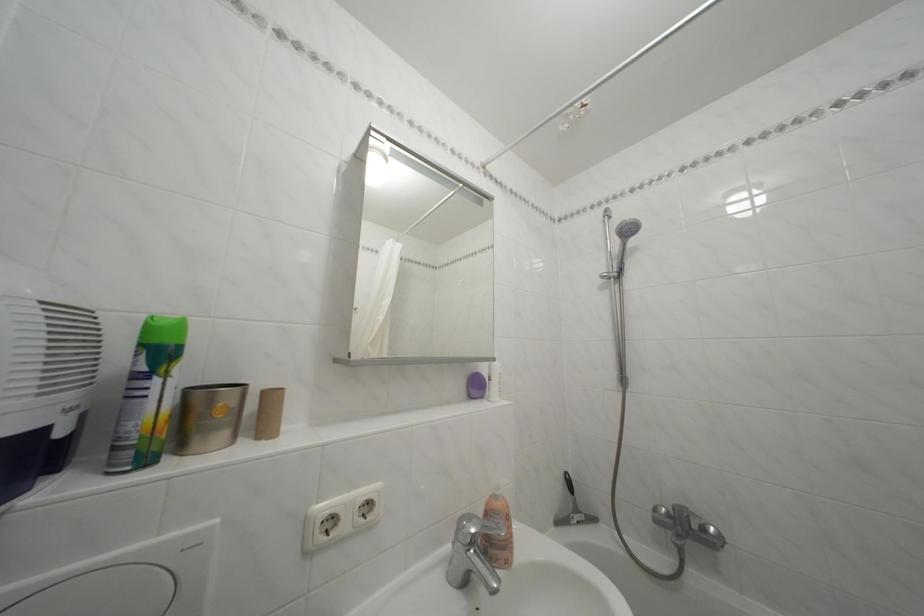
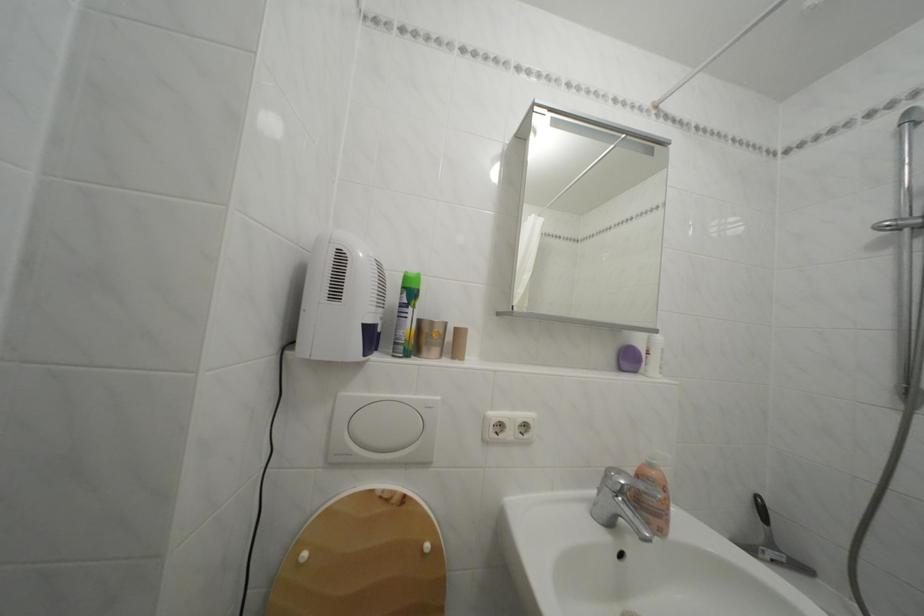
Question: The camera is either moving clockwise (left) or counter-clockwise (right) around the object. The first image is from the beginning of the video and the second image is from the end. Is the camera moving left or right when shooting the video?

Choices:
 (A) Left
 (B) Right

Answer: (B)